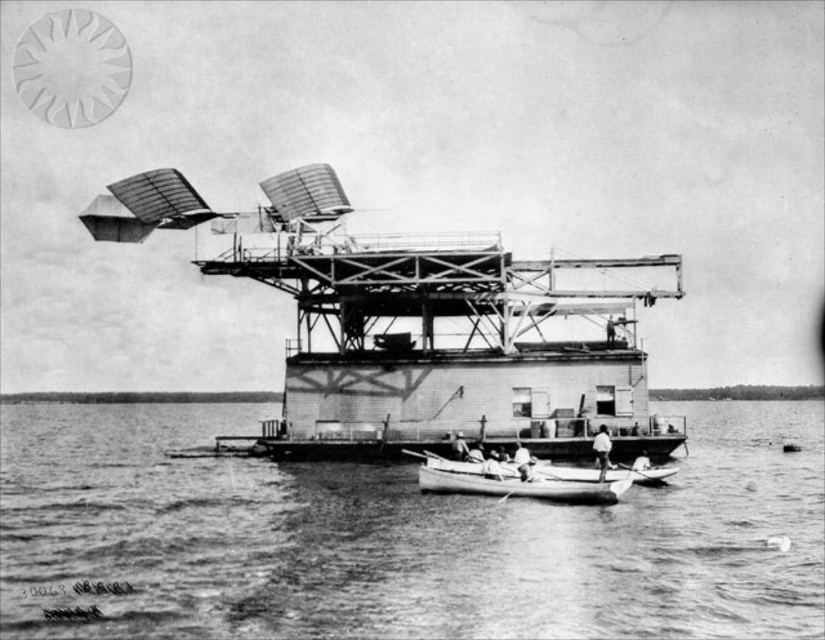
Who is taller, smooth water at center or smooth white canoe at center?

smooth water at center is taller.

Based on the photo, is smooth water at center shorter than smooth white canoe at center?

In fact, smooth water at center may be taller than smooth white canoe at center.

Does point (214, 532) lie in front of point (606, 481)?

Yes.

Find the location of `smooth water at center`. smooth water at center is located at coordinates coord(396,538).